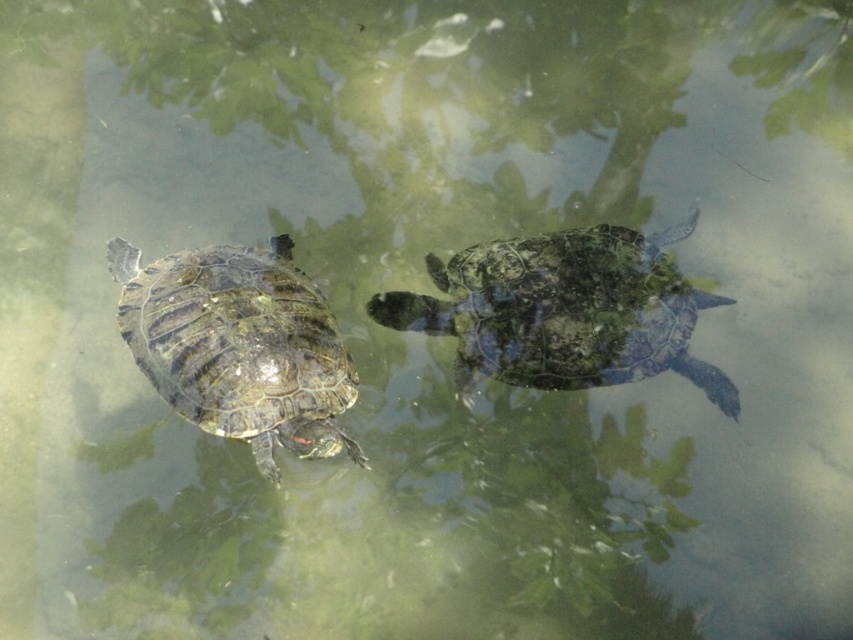
Question: Is textured greenish-brown tortoise at center positioned behind shiny green tortoise at left?

Choices:
 (A) no
 (B) yes

Answer: (B)

Question: Which point appears farthest from the camera in this image?

Choices:
 (A) (616, 362)
 (B) (244, 259)

Answer: (B)

Question: Which object is farther from the camera taking this photo?

Choices:
 (A) textured greenish-brown tortoise at center
 (B) shiny green tortoise at left

Answer: (A)

Question: Does textured greenish-brown tortoise at center have a smaller size compared to shiny green tortoise at left?

Choices:
 (A) yes
 (B) no

Answer: (A)

Question: Is textured greenish-brown tortoise at center positioned behind shiny green tortoise at left?

Choices:
 (A) no
 (B) yes

Answer: (B)